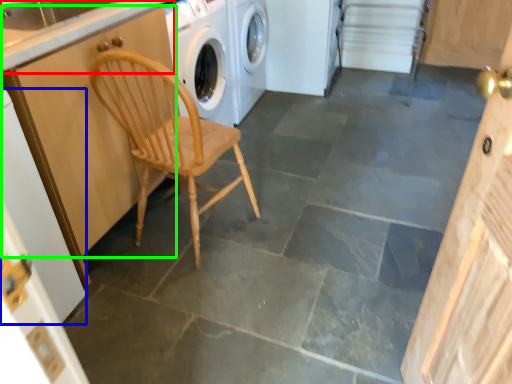
Question: Considering the real-world distances, which object is closest to counter top (highlighted by a red box)? door (highlighted by a blue box) or cabinetry (highlighted by a green box).

Choices:
 (A) door
 (B) cabinetry

Answer: (B)